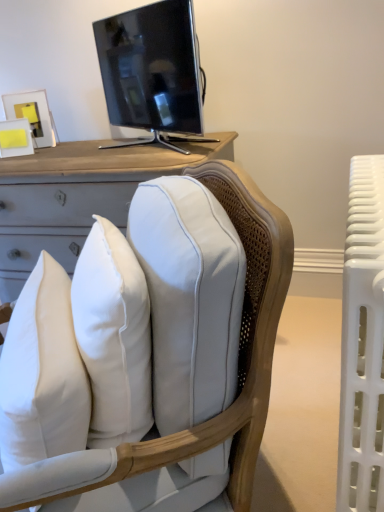
Image resolution: width=384 pixels, height=512 pixels. Identify the location of white plastic radiator at right. (363, 342).

What is the approximate height of white soft pillow at center?

white soft pillow at center is 13.71 inches in height.

Describe the element at coordinates (240, 374) in the screenshot. I see `white leather chair at center` at that location.

Where is `white plastic radiator at right`? The height and width of the screenshot is (512, 384). white plastic radiator at right is located at coordinates (363, 342).

Between white plastic radiator at right and matte black tv at upper center, which one appears on the left side from the viewer's perspective?

matte black tv at upper center.

How far apart are white plastic radiator at right and matte black tv at upper center?

white plastic radiator at right is 37.26 inches away from matte black tv at upper center.

Considering the relative sizes of white plastic radiator at right and matte black tv at upper center in the image provided, is white plastic radiator at right bigger than matte black tv at upper center?

Yes, white plastic radiator at right is bigger than matte black tv at upper center.

From the image's perspective, is white plastic radiator at right over matte black tv at upper center?

No, from the image's perspective, white plastic radiator at right is not over matte black tv at upper center.

Is white soft pillow at center thinner than white leather chair at center?

Yes.

From a real-world perspective, is white soft pillow at center physically located above or below white leather chair at center?

white soft pillow at center is above white leather chair at center.

Is white soft pillow at center inside the boundaries of white leather chair at center, or outside?

white soft pillow at center is contained in white leather chair at center.

From the image's perspective, who appears lower, white soft pillow at center or white leather chair at center?

From the image's view, white leather chair at center is below.

From the picture: Does matte black tv at upper center come behind white soft pillow at center?

Yes, matte black tv at upper center is behind white soft pillow at center.

Is matte black tv at upper center with white soft pillow at center?

They are not placed beside each other.

Is matte black tv at upper center wider or thinner than white soft pillow at center?

matte black tv at upper center is wider than white soft pillow at center.

Considering the relative positions of matte black tv at upper center and white soft pillow at center in the image provided, is matte black tv at upper center to the left of white soft pillow at center from the viewer's perspective?

Incorrect, matte black tv at upper center is not on the left side of white soft pillow at center.

Looking at this image, is white plastic radiator at right surrounded by matte black tv at upper center?

No, white plastic radiator at right is located outside of matte black tv at upper center.

Is matte black tv at upper center oriented towards white plastic radiator at right?

No.

Consider the image. How many degrees apart are the facing directions of matte black tv at upper center and white plastic radiator at right?

52.8 degrees separate the facing orientations of matte black tv at upper center and white plastic radiator at right.

Is the position of matte black tv at upper center less distant than that of white plastic radiator at right?

No, matte black tv at upper center is behind white plastic radiator at right.

Considering the sizes of objects white leather chair at center and white plastic radiator at right in the image provided, who is shorter, white leather chair at center or white plastic radiator at right?

Standing shorter between the two is white plastic radiator at right.

Does point (247, 482) appear closer or farther from the camera than point (365, 373)?

Point (247, 482) is positioned farther from the camera compared to point (365, 373).

Between white leather chair at center and white plastic radiator at right, which one has larger size?

Bigger between the two is white leather chair at center.

Which is more to the left, white leather chair at center or white plastic radiator at right?

white leather chair at center.

Based on the photo, from a real-world perspective, who is located higher, white leather chair at center or white soft pillow at center?

In real-world perspective, white soft pillow at center is above.

Find the location of a particular element. pillow lying above the white leather chair at center (from the image's perspective) is located at coordinates (42, 373).

From the image's perspective, which one is positioned lower, white leather chair at center or white soft pillow at center?

white leather chair at center appears lower in the image.

Is white leather chair at center wider than white soft pillow at center?

Yes.

Based on the photo, is white plastic radiator at right to the left of white leather chair at center from the viewer's perspective?

In fact, white plastic radiator at right is to the right of white leather chair at center.

Considering the sizes of white plastic radiator at right and white leather chair at center in the image, is white plastic radiator at right bigger or smaller than white leather chair at center?

In the image, white plastic radiator at right appears to be smaller than white leather chair at center.

Is white plastic radiator at right spatially inside white leather chair at center, or outside of it?

white plastic radiator at right cannot be found inside white leather chair at center.

Find the location of a particular element. This screenshot has width=384, height=512. television above the white plastic radiator at right (from the image's perspective) is located at coordinates (152, 70).

At what (x,y) coordinates should I click in order to perform the action: click on pillow positioned vertically above the white leather chair at center (from a real-world perspective). Please return your answer as a coordinate pair (x, y). The height and width of the screenshot is (512, 384). Looking at the image, I should click on (42, 373).

Looking at the image, which one is located closer to white leather chair at center, matte black tv at upper center or white plastic radiator at right?

Among the two, white plastic radiator at right is located nearer to white leather chair at center.

Based on their spatial positions, is white soft pillow at center or white plastic radiator at right closer to white leather chair at center?

The object closer to white leather chair at center is white soft pillow at center.

When comparing their distances from matte black tv at upper center, does white leather chair at center or white plastic radiator at right seem closer?

white leather chair at center is closer to matte black tv at upper center.

When comparing their distances from white soft pillow at center, does white plastic radiator at right or white leather chair at center seem further?

Among the two, white plastic radiator at right is located further to white soft pillow at center.

From the image, which object appears to be farther from white soft pillow at center, white leather chair at center or matte black tv at upper center?

matte black tv at upper center is positioned further to the anchor white soft pillow at center.

From the image, which object appears to be farther from matte black tv at upper center, white soft pillow at center or white plastic radiator at right?

The object further to matte black tv at upper center is white soft pillow at center.

Estimate the real-world distances between objects in this image. Which object is closer to white leather chair at center, white plastic radiator at right or matte black tv at upper center?

Among the two, white plastic radiator at right is located nearer to white leather chair at center.

Estimate the real-world distances between objects in this image. Which object is further from white leather chair at center, matte black tv at upper center or white soft pillow at center?

Among the two, matte black tv at upper center is located further to white leather chair at center.

Locate an element on the screen. This screenshot has width=384, height=512. radiator between matte black tv at upper center and white soft pillow at center vertically is located at coordinates (363, 342).

Find the location of a particular element. The width and height of the screenshot is (384, 512). chair between white soft pillow at center and white plastic radiator at right from left to right is located at coordinates (240, 374).

Image resolution: width=384 pixels, height=512 pixels. I want to click on pillow between matte black tv at upper center and white leather chair at center in the vertical direction, so click(42, 373).

This screenshot has width=384, height=512. What are the coordinates of `radiator that lies between matte black tv at upper center and white leather chair at center from top to bottom` in the screenshot? It's located at (363, 342).